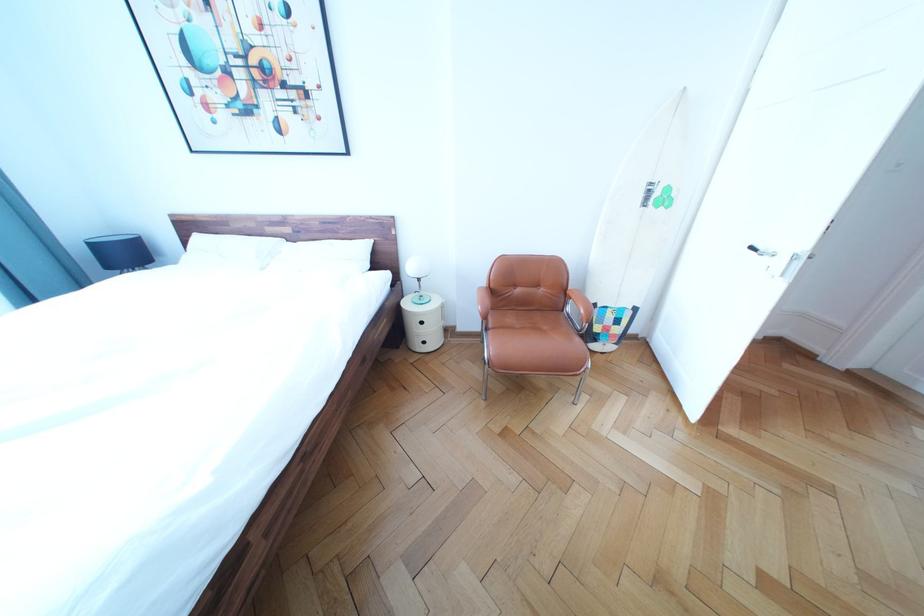
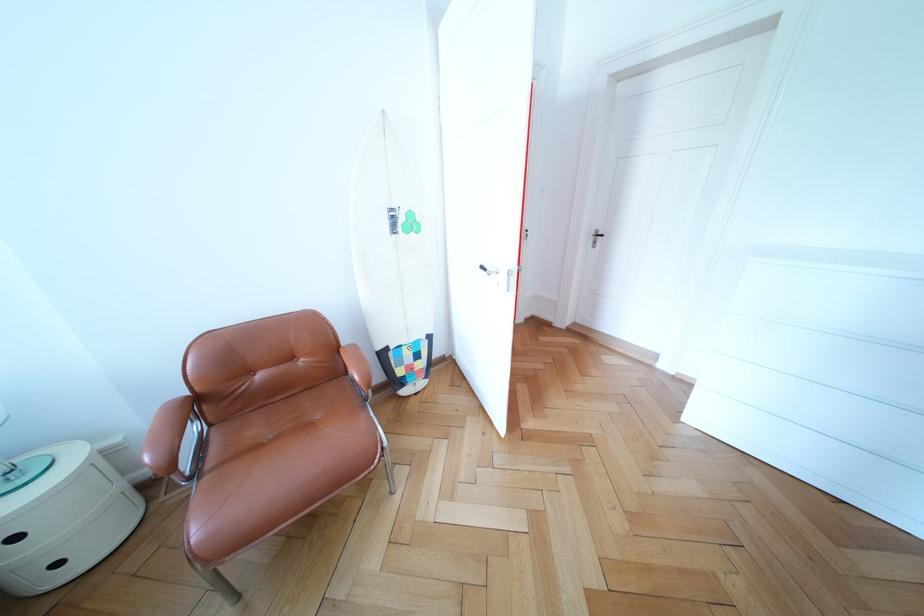
Question: How did the camera likely rotate?

Choices:
 (A) Left
 (B) Right
 (C) Up
 (D) Down

Answer: (B)